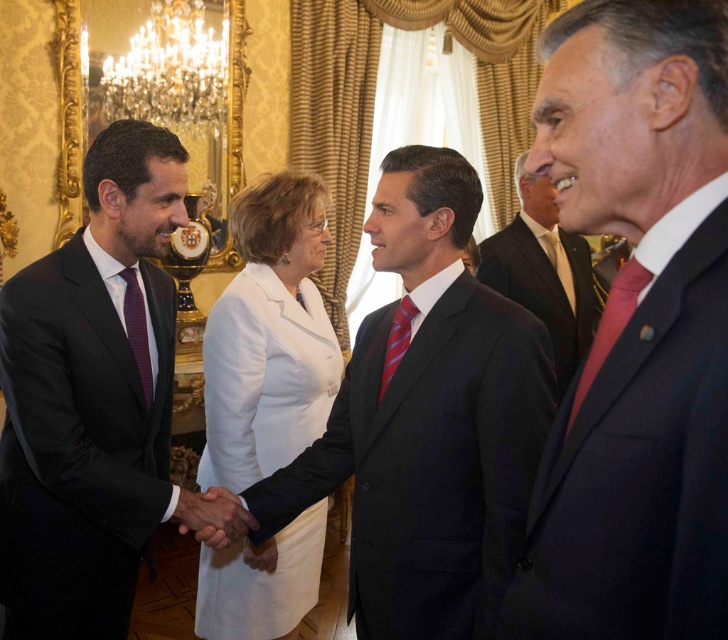
You are an event photographer at the meeting. You need to capture a closeup of the black smooth suit at center and the striped silk tie at center. Since the camera can only focus on one object at a time, which one should you focus on first to ensure it appears sharp in the photo?

The black smooth suit at center is below striped silk tie at center, so you should focus on the striped silk tie at center first because it is closer to the camera.

You are attending a formal event and need to take a photo of the dark suit at left and the red satin tie at right. Which one should you focus on first to ensure it is in clear view?

You should focus on the dark suit at left first because it is closer to you than the red satin tie at right, ensuring it stays in clear view.

You are an event photographer at the meeting. You need to capture a photo of the dark suit at left and the red satin tie at right. Based on their positions, which object should you focus on first to ensure both are in frame?

The dark suit at left is located below the red satin tie at right, so you should focus on the red satin tie at right first to ensure both are in frame.